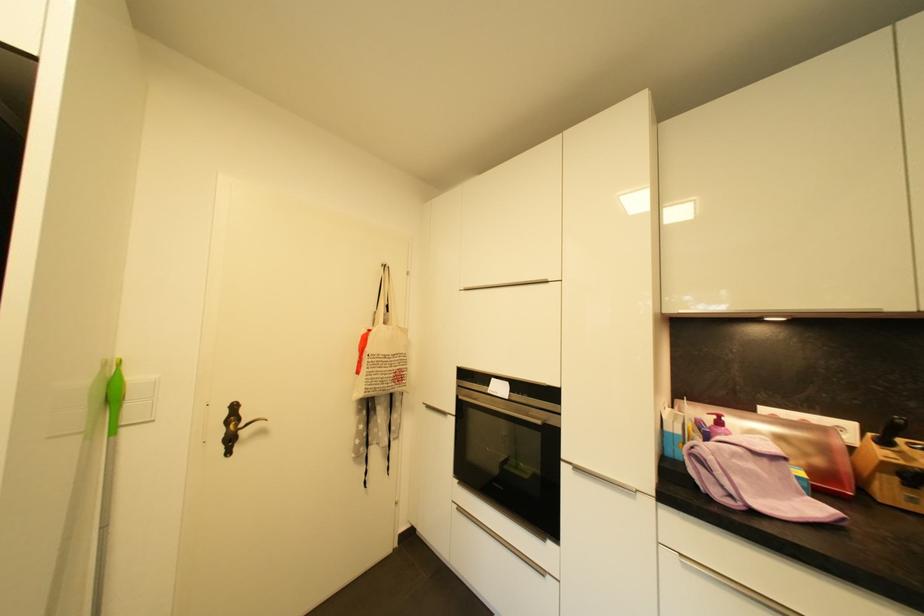
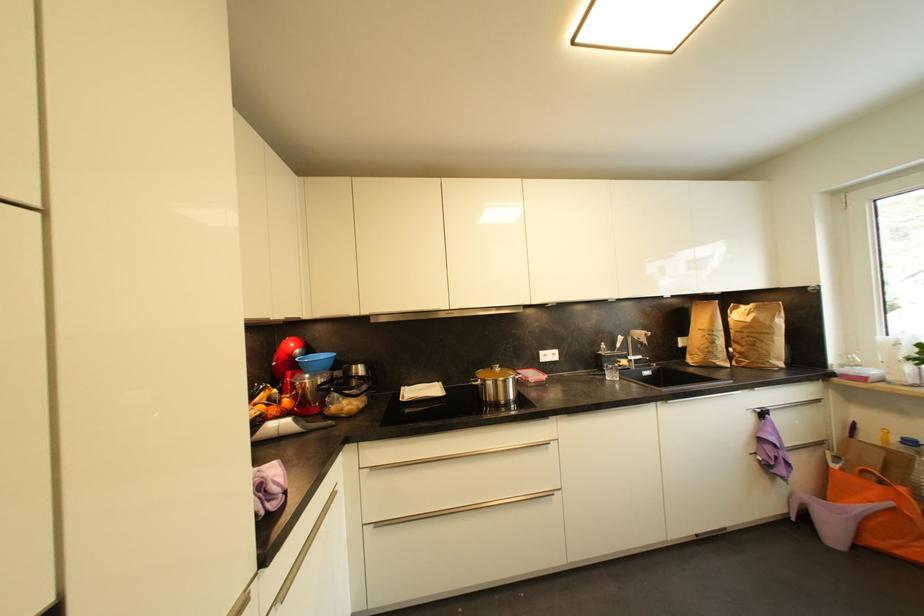
Question: I am providing you with two images of the same scene from different viewpoints. After the viewpoint changes to image2, which objects are now occluded?

Choices:
 (A) pot lid handle
 (B) black knife handle
 (C) red and white jar
 (D) small red container

Answer: (B)